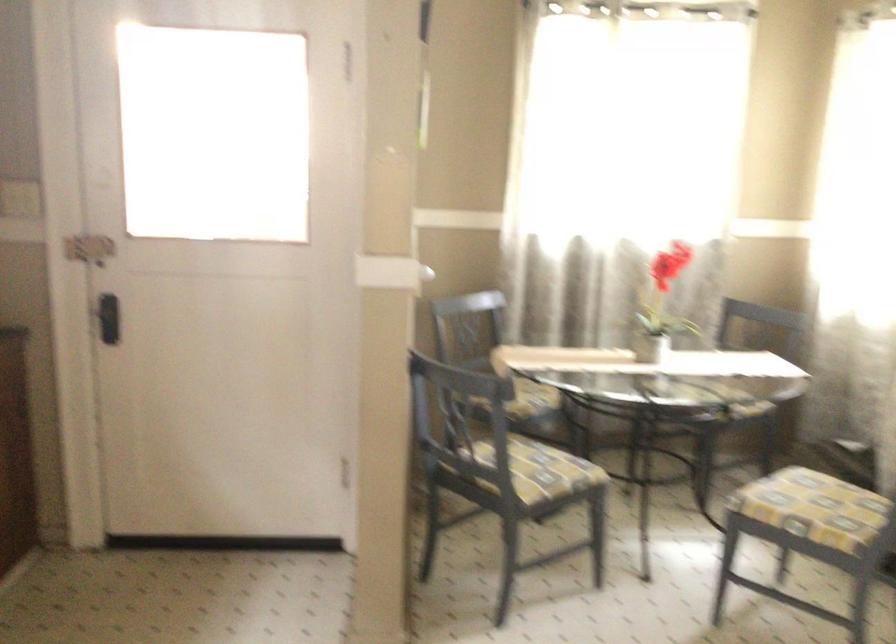
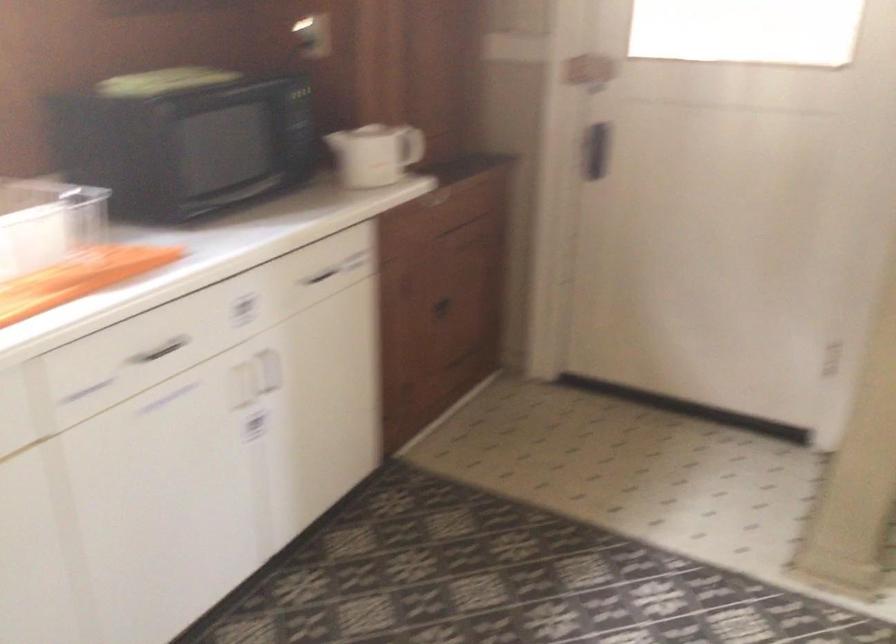
Question: The images are taken continuously from a first-person perspective. In which direction is your viewpoint rotating?

Choices:
 (A) Left
 (B) Right
 (C) Up
 (D) Down

Answer: (A)